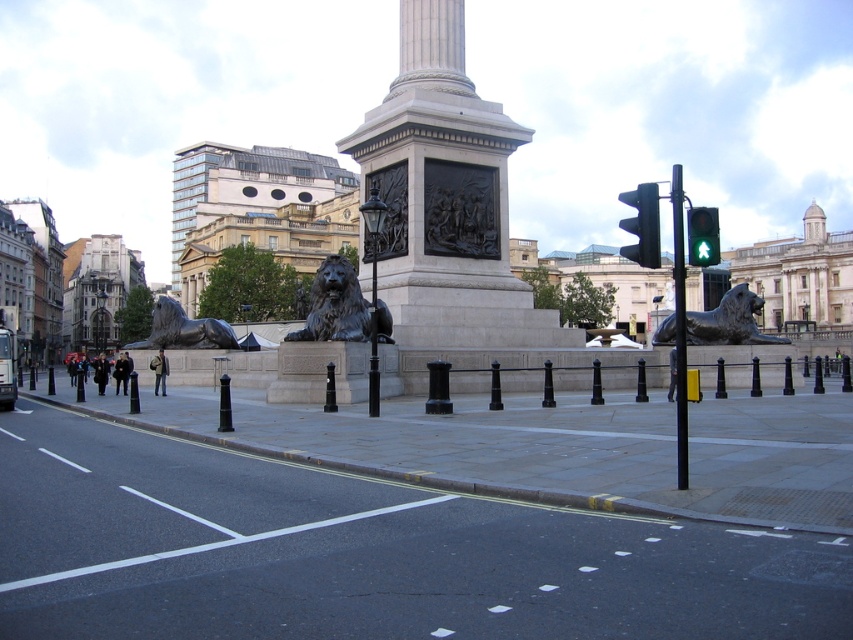
Does bronze lion at center have a larger size compared to black polished stone post at center?

No, bronze lion at center is not bigger than black polished stone post at center.

Can you confirm if bronze lion at center is smaller than black polished stone post at center?

Indeed, bronze lion at center has a smaller size compared to black polished stone post at center.

The height and width of the screenshot is (640, 853). What are the coordinates of `bronze lion at center` in the screenshot? It's located at (341, 307).

Who is more forward, (740, 332) or (230, 337)?

Point (740, 332) is in front.

Is shiny silver lion at right thinner than bronze lion at left?

Correct, shiny silver lion at right's width is less than bronze lion at left's.

Who is more distant from viewer, (722, 310) or (194, 336)?

Positioned behind is point (194, 336).

Identify the location of shiny silver lion at right. (729, 321).

Does black glass traffic light at upper right have a lesser width compared to black polished stone post at center?

No, black glass traffic light at upper right is not thinner than black polished stone post at center.

This screenshot has width=853, height=640. Identify the location of black glass traffic light at upper right. coord(642,225).

The height and width of the screenshot is (640, 853). I want to click on black glass traffic light at upper right, so click(x=642, y=225).